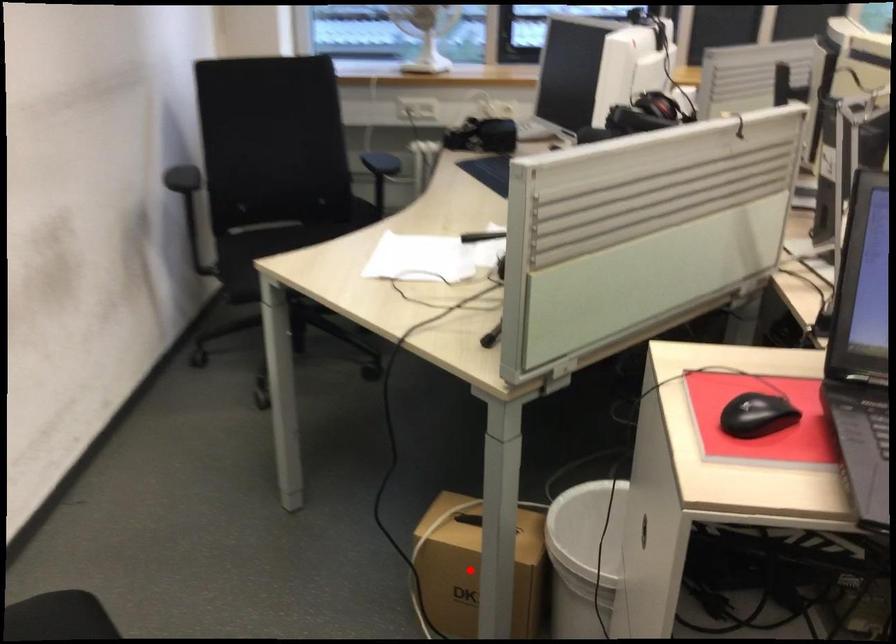
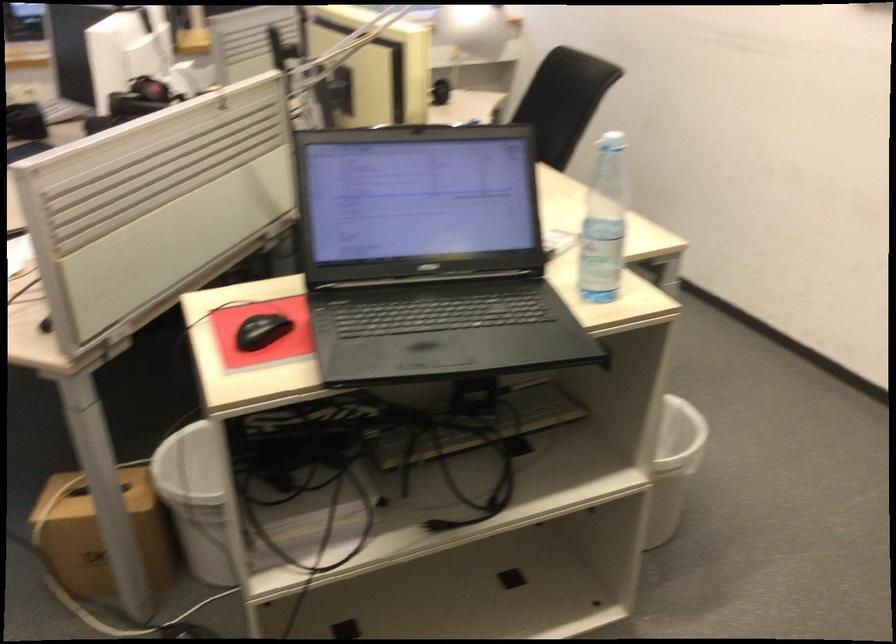
Question: I am providing you with two images of the same scene from different viewpoints. Image1 has a red point marked. In image2, the corresponding 3D location appears at what relative position? Reply with the corresponding letter.

Choices:
 (A) Closer
 (B) Farther

Answer: (B)